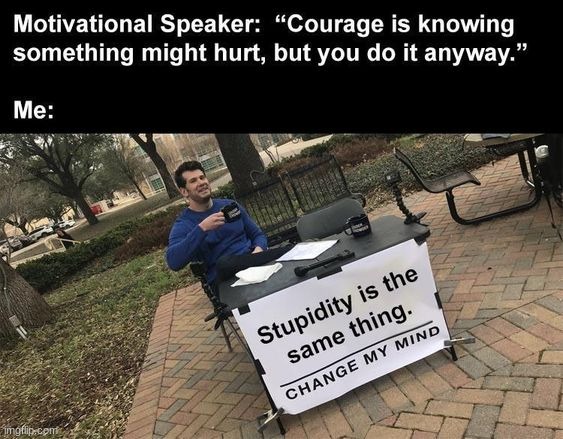
Find the location of a particular element. papers is located at coordinates (256, 271), (314, 250).